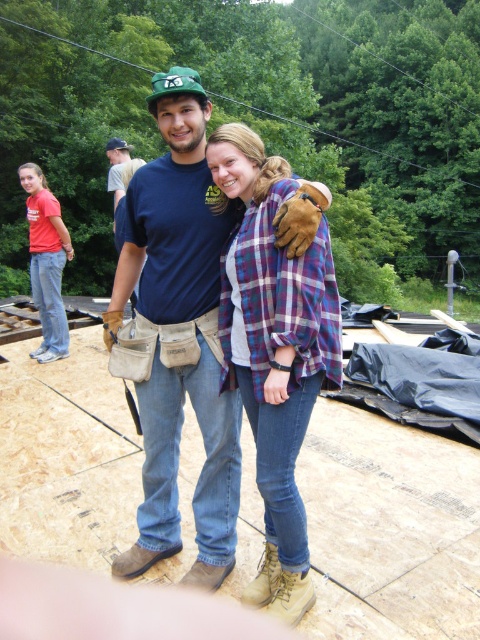
You are standing at the center of the image. There is a point marked at coordinates [178,337]. What object is located at that point?

The point at coordinates [178,337] indicates brown leather boots at center.

You are a safety inspector reviewing the image. You notice two items of clothing at the center of the image. The brown leather boots at center and the plaid fabric shirt at center. According to safety protocols, footwear must be positioned to the right of upper body clothing. Is the current arrangement compliant with safety standards?

The brown leather boots at center is positioned on the left side of plaid fabric shirt at center, which violates the safety protocol requiring footwear to be to the right of upper body clothing. Therefore, the arrangement is not compliant.